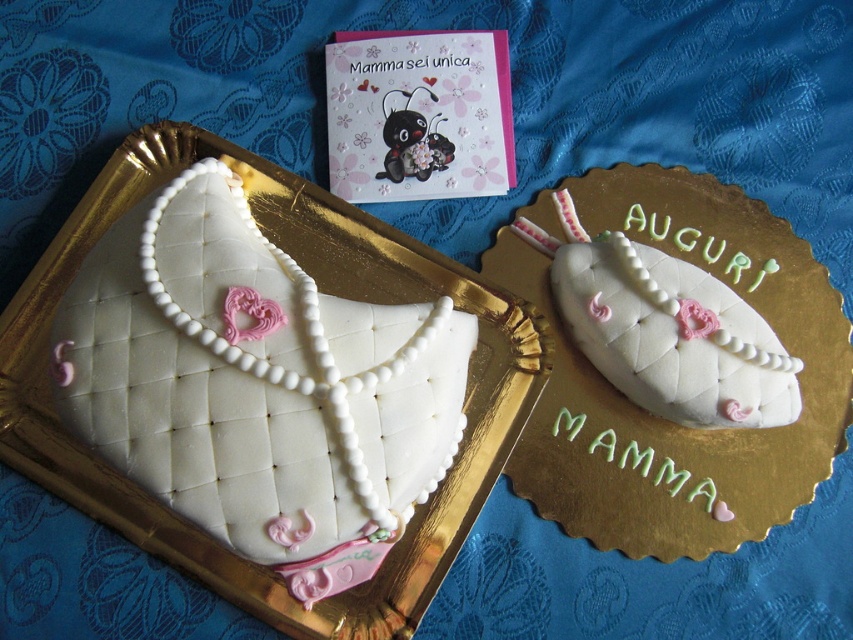
Question: Which point appears farthest from the camera in this image?

Choices:
 (A) (573, 328)
 (B) (231, 227)

Answer: (A)

Question: Which point is closer to the camera taking this photo?

Choices:
 (A) (784, 390)
 (B) (169, 323)

Answer: (B)

Question: Is white fondant purse at upper left to the left of white fondant purse at upper center from the viewer's perspective?

Choices:
 (A) yes
 (B) no

Answer: (A)

Question: Can you confirm if white fondant purse at upper left is smaller than white fondant purse at upper center?

Choices:
 (A) yes
 (B) no

Answer: (B)

Question: Is white fondant purse at upper left wider than white fondant purse at upper center?

Choices:
 (A) yes
 (B) no

Answer: (A)